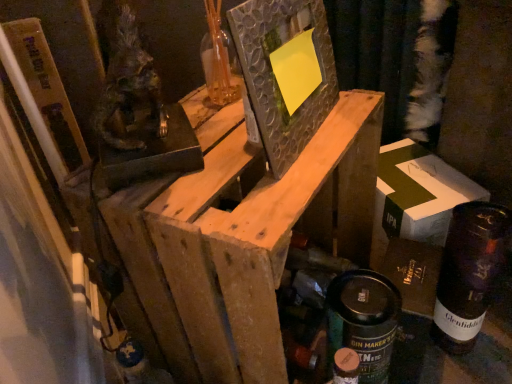
The width and height of the screenshot is (512, 384). Identify the location of white cardboard box at right. [416, 197].

Where is `dark glass bottle at lower right`? dark glass bottle at lower right is located at coordinates (469, 273).

Consider the image. What's the angular difference between white cardboard box at right and dark glass bottle at lower right's facing directions?

There is a 33.6-degree angle between the facing directions of white cardboard box at right and dark glass bottle at lower right.

Which object is positioned more to the left, white cardboard box at right or dark glass bottle at lower right?

From the viewer's perspective, white cardboard box at right appears more on the left side.

Could dark glass bottle at lower right be considered to be inside white cardboard box at right?

No, dark glass bottle at lower right is not surrounded by white cardboard box at right.

From a real-world perspective, which object rests below the other?

white cardboard box at right is physically lower.

Locate an element on the screen. bottle behind the wooden frame at center is located at coordinates (469, 273).

Between point (484, 293) and point (168, 264), which one is positioned behind?

The point (484, 293) is farther from the camera.

From a real-world perspective, between dark glass bottle at lower right and wooden frame at center, who is vertically higher?

wooden frame at center, from a real-world perspective.

Is the surface of textured glass picture frame at center in direct contact with dark glass bottle at lower right?

No, textured glass picture frame at center is not beside dark glass bottle at lower right.

This screenshot has height=384, width=512. Identify the location of picture frame in front of the dark glass bottle at lower right. (274, 75).

Which is closer to the camera, (234, 25) or (440, 296)?

The point (234, 25) is more forward.

Can you confirm if textured glass picture frame at center is shorter than dark glass bottle at lower right?

Yes, textured glass picture frame at center is shorter than dark glass bottle at lower right.

Is wooden frame at center facing away from matte black spray can at lower right?

Yes, matte black spray can at lower right is at the back of wooden frame at center.

Is point (208, 323) positioned behind point (337, 342)?

No, it is in front of (337, 342).

How many degrees apart are the facing directions of wooden frame at center and matte black spray can at lower right?

The facing directions of wooden frame at center and matte black spray can at lower right are 4.13 degrees apart.

From a real-world perspective, is wooden frame at center beneath matte black spray can at lower right?

Incorrect, from a real-world perspective, wooden frame at center is higher than matte black spray can at lower right.

Between point (296, 4) and point (399, 294), which one is positioned behind?

Positioned behind is point (399, 294).

From their relative heights in the image, would you say textured glass picture frame at center is taller or shorter than matte black spray can at lower right?

textured glass picture frame at center is shorter than matte black spray can at lower right.

Is textured glass picture frame at center positioned with its back to matte black spray can at lower right?

No, textured glass picture frame at center's orientation is not away from matte black spray can at lower right.

Is textured glass picture frame at center not close to matte black spray can at lower right?

No, there isn't a large distance between textured glass picture frame at center and matte black spray can at lower right.

Locate an element on the screen. The height and width of the screenshot is (384, 512). furniture located on the left of white cardboard box at right is located at coordinates (255, 239).

Does white cardboard box at right have a lesser width compared to wooden frame at center?

Correct, the width of white cardboard box at right is less than that of wooden frame at center.

From a real-world perspective, which object stands above the other?

wooden frame at center is physically above.

Would you say white cardboard box at right is inside or outside wooden frame at center?

white cardboard box at right cannot be found inside wooden frame at center.

At what (x,y) coordinates should I click in order to perform the action: click on spray can above the white cardboard box at right (from a real-world perspective). Please return your answer as a coordinate pair (x, y). Looking at the image, I should click on (362, 321).

Does matte black spray can at lower right turn towards white cardboard box at right?

No, matte black spray can at lower right is not aimed at white cardboard box at right.

From the image's perspective, is matte black spray can at lower right located above or below white cardboard box at right?

Clearly, from the image's perspective, matte black spray can at lower right is below white cardboard box at right.

Find the location of `bottle below the white cardboard box at right (from the image's perspective)`. bottle below the white cardboard box at right (from the image's perspective) is located at coordinates (469, 273).

The image size is (512, 384). In order to click on furniture located above the dark glass bottle at lower right (from the image's perspective) in this screenshot , I will do `click(255, 239)`.

Considering their positions, is textured glass picture frame at center positioned further to dark glass bottle at lower right than wooden frame at center?

textured glass picture frame at center lies further to dark glass bottle at lower right than the other object.

Estimate the real-world distances between objects in this image. Which object is closer to dark glass bottle at lower right, textured glass picture frame at center or white cardboard box at right?

white cardboard box at right is positioned closer to the anchor dark glass bottle at lower right.

Looking at this image, based on their spatial positions, is wooden frame at center or matte black spray can at lower right further from dark glass bottle at lower right?

wooden frame at center.

Estimate the real-world distances between objects in this image. Which object is closer to wooden frame at center, textured glass picture frame at center or white cardboard box at right?

The object closer to wooden frame at center is textured glass picture frame at center.

Considering their positions, is white cardboard box at right positioned further to wooden frame at center than matte black spray can at lower right?

white cardboard box at right is positioned further to the anchor wooden frame at center.

Looking at the image, which one is located further to dark glass bottle at lower right, white cardboard box at right or textured glass picture frame at center?

textured glass picture frame at center is positioned further to the anchor dark glass bottle at lower right.

Based on their spatial positions, is white cardboard box at right or matte black spray can at lower right closer to dark glass bottle at lower right?

Based on the image, white cardboard box at right appears to be nearer to dark glass bottle at lower right.

Which object lies further to the anchor point white cardboard box at right, textured glass picture frame at center or wooden frame at center?

Based on the image, textured glass picture frame at center appears to be further to white cardboard box at right.

Where is `bottle between textured glass picture frame at center and matte black spray can at lower right vertically`? bottle between textured glass picture frame at center and matte black spray can at lower right vertically is located at coordinates (469, 273).

The image size is (512, 384). In order to click on bottle positioned between textured glass picture frame at center and white cardboard box at right from near to far in this screenshot , I will do `click(469, 273)`.

The width and height of the screenshot is (512, 384). Identify the location of spray can between wooden frame at center and white cardboard box at right in the front-back direction. (362, 321).

This screenshot has width=512, height=384. Find the location of `spray can between wooden frame at center and dark glass bottle at lower right in the horizontal direction`. spray can between wooden frame at center and dark glass bottle at lower right in the horizontal direction is located at coordinates (362, 321).